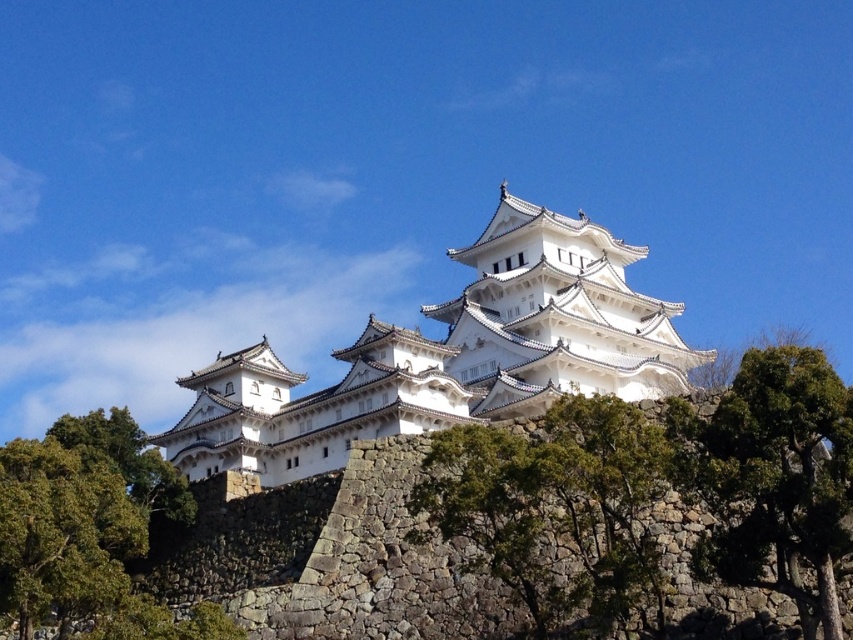
You are a bird flying over the castle. You want to land on the green leafy tree at lower center. Is the white stone castle at center blocking your path directly above the tree?

The white stone castle at center is positioned over the green leafy tree at lower center, so yes, the castle is blocking the path directly above the tree.

You are a painter standing at the base of the hill, looking up at the white stone castle at center and the green leafy tree at lower center. Which object appears wider from your perspective?

The white stone castle at center appears wider than the green leafy tree at lower center because its width surpasses the tree.